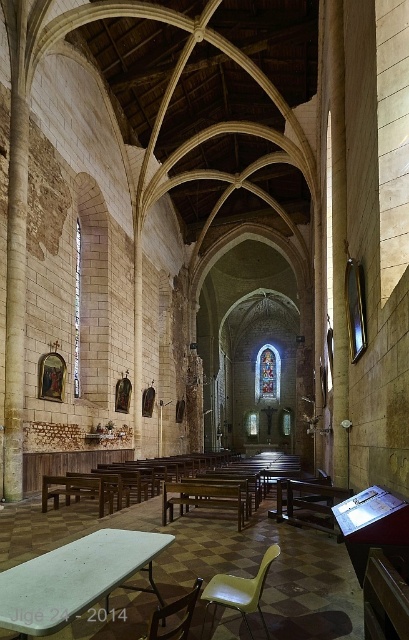
Is white plastic table at center shorter than matte beige chair at lower center?

No, white plastic table at center is not shorter than matte beige chair at lower center.

Is white plastic table at center to the right of matte beige chair at lower center from the viewer's perspective?

Incorrect, white plastic table at center is not on the right side of matte beige chair at lower center.

I want to click on white plastic table at center, so click(74, 579).

Does wooden table at center appear on the right side of matte beige chair at lower center?

Indeed, wooden table at center is positioned on the right side of matte beige chair at lower center.

The image size is (409, 640). What do you see at coordinates (202, 499) in the screenshot? I see `wooden table at center` at bounding box center [202, 499].

Find the location of a particular element. wooden table at center is located at coordinates (202, 499).

Between light green plastic chair at lower center and matte beige chair at lower center, which one is positioned lower?

light green plastic chair at lower center

In the scene shown: Is light green plastic chair at lower center smaller than matte beige chair at lower center?

No.

In order to click on light green plastic chair at lower center in this screenshot , I will do `click(240, 592)`.

Where is `light green plastic chair at lower center`? The width and height of the screenshot is (409, 640). light green plastic chair at lower center is located at coordinates (240, 592).